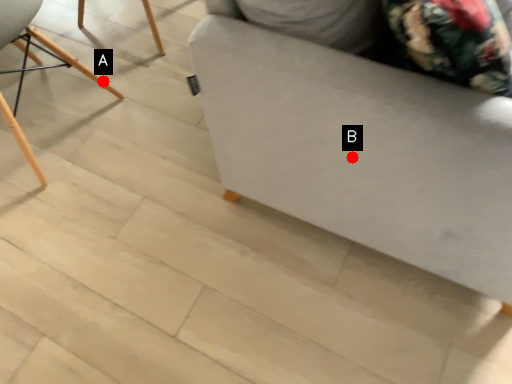
Question: Two points are circled on the image, labeled by A and B beside each circle. Which point is farther from the camera taking this photo?

Choices:
 (A) A is further
 (B) B is further

Answer: (A)